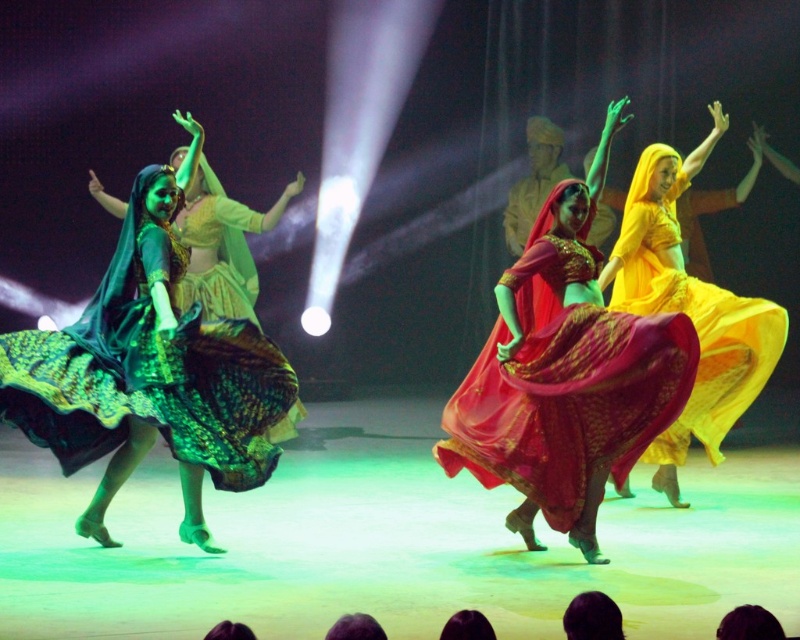
Question: Which of these objects is positioned farthest from the matte red dress at center?

Choices:
 (A) matte yellow dress at right
 (B) green satin dress at left

Answer: (B)

Question: Is matte red dress at center thinner than matte yellow dress at right?

Choices:
 (A) no
 (B) yes

Answer: (A)

Question: Which point appears closest to the camera in this image?

Choices:
 (A) (612, 356)
 (B) (148, 422)
 (C) (734, 385)

Answer: (B)

Question: Which of these objects is positioned farthest from the green satin dress at left?

Choices:
 (A) matte yellow dress at right
 (B) matte red dress at center

Answer: (A)

Question: Does green satin dress at left have a greater width compared to matte yellow dress at right?

Choices:
 (A) yes
 (B) no

Answer: (A)

Question: Is green satin dress at left wider than matte yellow dress at right?

Choices:
 (A) no
 (B) yes

Answer: (B)